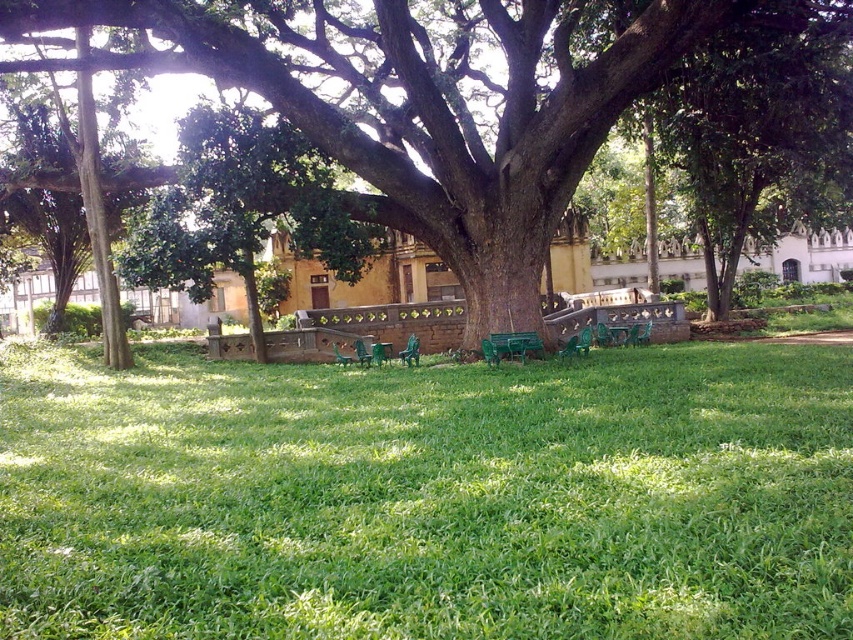
You are standing in the park and want to find a spot where you can avoid the shade from the green leafy tree at upper right. Would the green grassy at center be a good place for that?

The green grassy at center is below the green leafy tree at upper right, so it is in the shade cast by the tree. To avoid the shade, you should look for a spot not under the tree.

You are planning to place a new flower pot between the green grassy at center and the green plastic bench at center in the park. The flower pot requires a space of 4 meters. Is there enough space between them to accommodate the flower pot?

The distance between the green grassy at center and the green plastic bench at center is 4.46 meters, which is more than enough to place the flower pot requiring 4 meters of space.

You are planning to set up a picnic blanket in the park. Given that the green grassy at center is smaller than the green leafy tree at upper right, which area would you choose to place your blanket to ensure it stays under the shade of the tree?

You should place the picnic blanket under the green leafy tree at upper right because it is larger than the green grassy at center, providing more shade coverage.